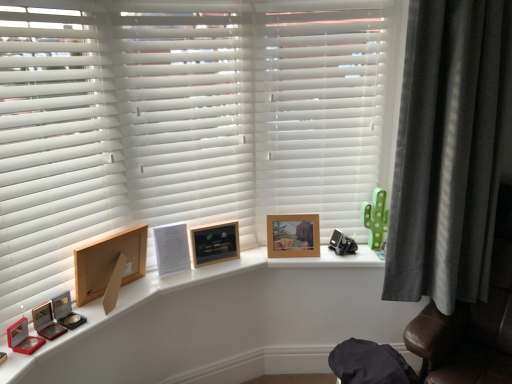
Question: Is wooden frame at upper center aimed at dark grey velvet curtain at right?

Choices:
 (A) yes
 (B) no

Answer: (B)

Question: Is wooden frame at upper center not close to dark grey velvet curtain at right?

Choices:
 (A) no
 (B) yes

Answer: (A)

Question: Is wooden frame at upper center further to the viewer compared to dark grey velvet curtain at right?

Choices:
 (A) no
 (B) yes

Answer: (A)

Question: Does wooden frame at upper center touch dark grey velvet curtain at right?

Choices:
 (A) yes
 (B) no

Answer: (B)

Question: Is wooden frame at upper center positioned with its back to dark grey velvet curtain at right?

Choices:
 (A) yes
 (B) no

Answer: (B)

Question: From a real-world perspective, relative to white matte shutter at left, the 1th shutter from the left, is white matte blinds at center, acting as the 2th shutter starting from the left, vertically above or below?

Choices:
 (A) below
 (B) above

Answer: (B)

Question: From the image's perspective, is white matte blinds at center, acting as the 2th shutter starting from the left, positioned above or below white matte shutter at left, the 1th shutter from the left?

Choices:
 (A) below
 (B) above

Answer: (B)

Question: Looking at their shapes, would you say white matte blinds at center, acting as the 2th shutter starting from the right, is wider or thinner than white matte shutter at left, which ranks as the 3th shutter in right-to-left order?

Choices:
 (A) wide
 (B) thin

Answer: (B)

Question: Would you say white matte blinds at center, acting as the 2th shutter starting from the left, is inside or outside white matte shutter at left, the 1th shutter from the left?

Choices:
 (A) outside
 (B) inside

Answer: (A)

Question: In the image, is wooden picture frame at left, which is the third picture frame from back to front, on the left side or the right side of wooden frame at upper center?

Choices:
 (A) right
 (B) left

Answer: (B)

Question: Is wooden picture frame at left, which is the third picture frame from back to front, in front of or behind wooden frame at upper center in the image?

Choices:
 (A) behind
 (B) front

Answer: (A)

Question: Considering the positions of wooden picture frame at left, which is counted as the first picture frame, starting from the front, and wooden frame at upper center in the image, is wooden picture frame at left, which is counted as the first picture frame, starting from the front, taller or shorter than wooden frame at upper center?

Choices:
 (A) tall
 (B) short

Answer: (A)

Question: Considering the positions of wooden picture frame at left, which is counted as the first picture frame, starting from the front, and wooden frame at upper center in the image, is wooden picture frame at left, which is counted as the first picture frame, starting from the front, bigger or smaller than wooden frame at upper center?

Choices:
 (A) small
 (B) big

Answer: (A)

Question: From the image's perspective, is dark grey velvet curtain at right above or below white matte shutter at upper center, the 1th shutter from the right?

Choices:
 (A) above
 (B) below

Answer: (B)

Question: From their relative heights in the image, would you say dark grey velvet curtain at right is taller or shorter than white matte shutter at upper center, the 1th shutter from the right?

Choices:
 (A) short
 (B) tall

Answer: (B)